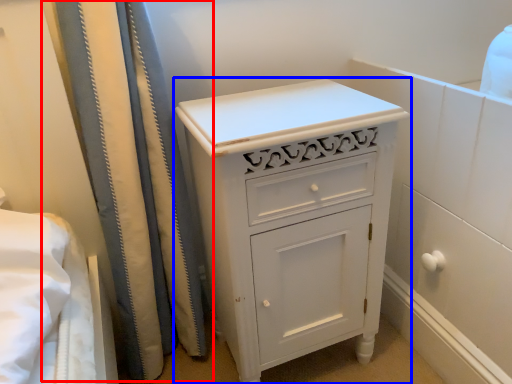
Question: Among these objects, which one is farthest to the camera, shower curtain (highlighted by a red box) or chest of drawers (highlighted by a blue box)?

Choices:
 (A) shower curtain
 (B) chest of drawers

Answer: (B)